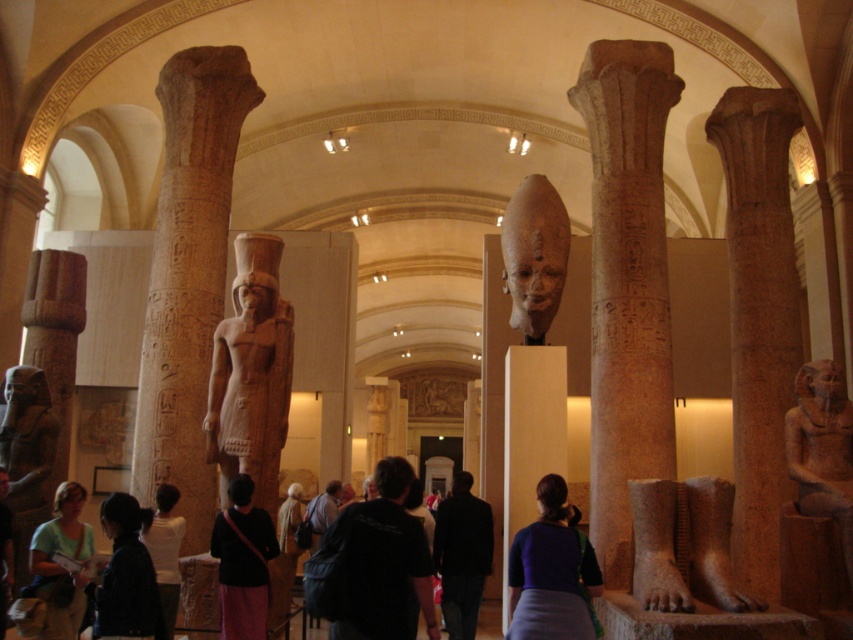
Which of these two, purple fabric bag at center or dark blue shirt at lower left, stands shorter?

dark blue shirt at lower left

Where is `purple fabric bag at center`? Image resolution: width=853 pixels, height=640 pixels. purple fabric bag at center is located at coordinates (550, 572).

Which is above, white marble statue at center or black fabric backpack at center?

white marble statue at center is above.

In the scene shown: Is white marble statue at center positioned before black fabric backpack at center?

Yes, white marble statue at center is in front of black fabric backpack at center.

Between point (564, 385) and point (321, 506), which one is positioned behind?

Point (321, 506)

In order to click on white marble statue at center in this screenshot , I will do `click(531, 435)`.

Which is behind, point (616, 401) or point (343, 634)?

The point (616, 401) is behind.

Describe the element at coordinates (627, 285) in the screenshot. The width and height of the screenshot is (853, 640). I see `brown stone column at center` at that location.

From the picture: Measure the distance between brown stone column at center and camera.

brown stone column at center is 81.66 feet away from camera.

At what (x,y) coordinates should I click in order to perform the action: click on brown stone column at center. Please return your answer as a coordinate pair (x, y). This screenshot has width=853, height=640. Looking at the image, I should click on (627, 285).